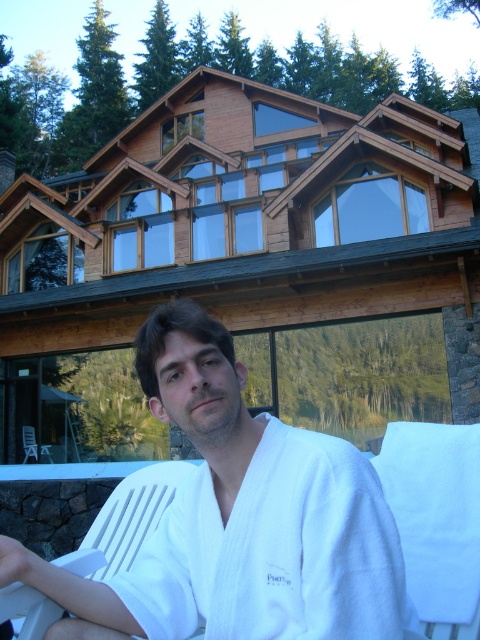
Is white plastic beach chair at lower left positioned behind white plastic chair at lower left?

No.

Can you confirm if white plastic beach chair at lower left is positioned above white plastic chair at lower left?

Yes, white plastic beach chair at lower left is above white plastic chair at lower left.

Find the location of `white plastic beach chair at lower left`. white plastic beach chair at lower left is located at coordinates (126, 520).

The height and width of the screenshot is (640, 480). What are the coordinates of `white plastic beach chair at lower left` in the screenshot? It's located at (126, 520).

Between white cotton bathrobe at center and white plastic chair at lower left, which one appears on the right side from the viewer's perspective?

white cotton bathrobe at center

Between point (336, 525) and point (32, 428), which one is positioned in front?

Point (336, 525) is more forward.

The width and height of the screenshot is (480, 640). In order to click on white cotton bathrobe at center in this screenshot , I will do `click(276, 552)`.

Who is more distant from viewer, (423,339) or (41,611)?

Point (423,339)

Is point (285, 358) positioned behind point (141, 541)?

That is True.

Does point (352, 387) lie behind point (104, 570)?

Yes, point (352, 387) is behind point (104, 570).

Find the location of a particular element. wooden cabin at upper center is located at coordinates (245, 266).